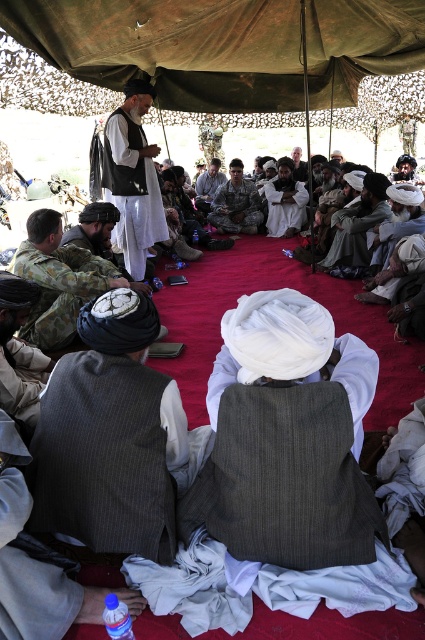
You are a photographer trying to capture a clear photo of the gray woolen vest at center and the camouflage fabric bag at left. Since you want both items to be visible in the frame, can you adjust your position so that neither object blocks the other?

The gray woolen vest at center is currently in front of the camouflage fabric bag at left. To ensure both are visible without obstruction, you should move your camera angle slightly to the side so that the vest and bag are no longer aligned vertically. This way, both objects will be visible in the frame without one blocking the other.

You are a photographer trying to capture a clear shot of the white cotton turban at center and the blue plastic bottle at lower left. Since the camera can only focus on one object at a time, which object should you prioritize focusing on first to ensure it appears sharp in the photo?

The white cotton turban at center should be prioritized for focusing first because it is larger in size compared to the blue plastic bottle at lower left, making it more prominent in the composition.

Based on the photo, you are a photographer trying to capture a detailed shot of the gray woolen vest at center and the camouflage fabric bag at left. Since you want both items to appear similarly sized in the photo, which object should you move closer to the camera?

The gray woolen vest at center is smaller in width than the camouflage fabric bag at left. To make them appear the same size in the photo, you should move the gray woolen vest at center closer to the camera while keeping the camouflage fabric bag at left at its current position.